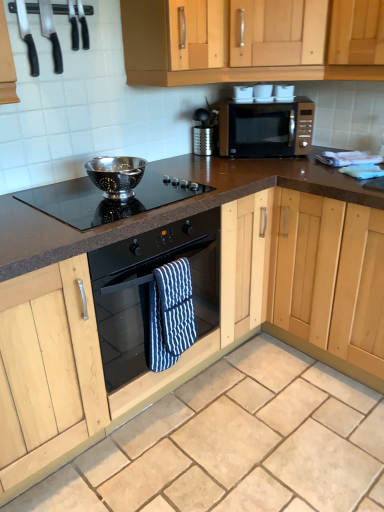
Question: Does blue striped oven mitt at center have a larger size compared to black glass cooktop at center?

Choices:
 (A) no
 (B) yes

Answer: (A)

Question: From the image's perspective, is blue striped oven mitt at center located above black glass cooktop at center?

Choices:
 (A) yes
 (B) no

Answer: (B)

Question: Is blue striped oven mitt at center positioned before black glass cooktop at center?

Choices:
 (A) no
 (B) yes

Answer: (A)

Question: From a real-world perspective, does blue striped oven mitt at center stand above black glass cooktop at center?

Choices:
 (A) no
 (B) yes

Answer: (A)

Question: Is blue striped oven mitt at center further to the viewer compared to black glass cooktop at center?

Choices:
 (A) no
 (B) yes

Answer: (B)

Question: Is the surface of blue striped oven mitt at center in direct contact with black glass cooktop at center?

Choices:
 (A) no
 (B) yes

Answer: (A)

Question: Can you confirm if black plastic knives at upper left, placed as the 2th appliance when sorted from left to right, is positioned to the right of black glass cooktop at center?

Choices:
 (A) yes
 (B) no

Answer: (B)

Question: Is black plastic knives at upper left, which ranks as the first appliance in right-to-left order, positioned far away from black glass cooktop at center?

Choices:
 (A) yes
 (B) no

Answer: (B)

Question: Considering the relative sizes of black plastic knives at upper left, which ranks as the first appliance in right-to-left order, and black glass cooktop at center in the image provided, is black plastic knives at upper left, which ranks as the first appliance in right-to-left order, wider than black glass cooktop at center?

Choices:
 (A) no
 (B) yes

Answer: (A)

Question: Can you confirm if black plastic knives at upper left, placed as the 2th appliance when sorted from left to right, is smaller than black glass cooktop at center?

Choices:
 (A) yes
 (B) no

Answer: (A)

Question: Is black plastic knives at upper left, which ranks as the first appliance in right-to-left order, positioned behind black glass cooktop at center?

Choices:
 (A) no
 (B) yes

Answer: (B)

Question: Is black glass cooktop at center inside black plastic knives at upper left, placed as the 2th appliance when sorted from left to right?

Choices:
 (A) yes
 (B) no

Answer: (B)

Question: Is satin gold microwave at upper center positioned beyond the bounds of black glass oven at center?

Choices:
 (A) yes
 (B) no

Answer: (A)